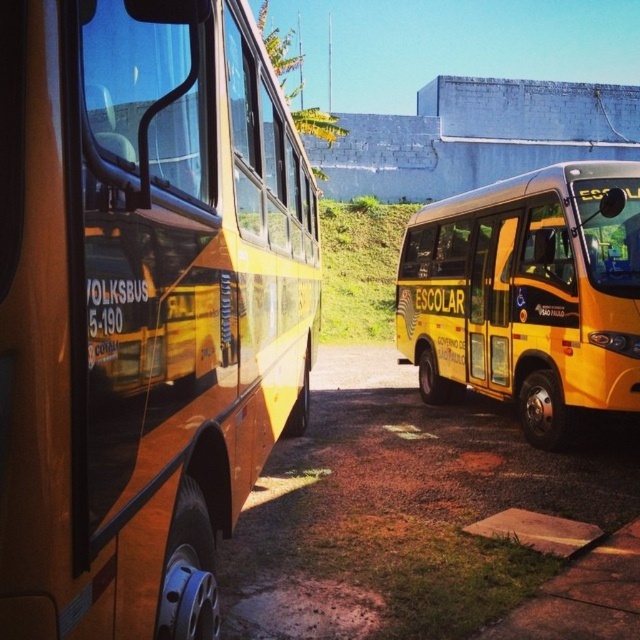
Which is below, yellow matte bus at center or yellow matte bus at right?

yellow matte bus at right is below.

The width and height of the screenshot is (640, 640). What are the coordinates of `yellow matte bus at center` in the screenshot? It's located at (141, 307).